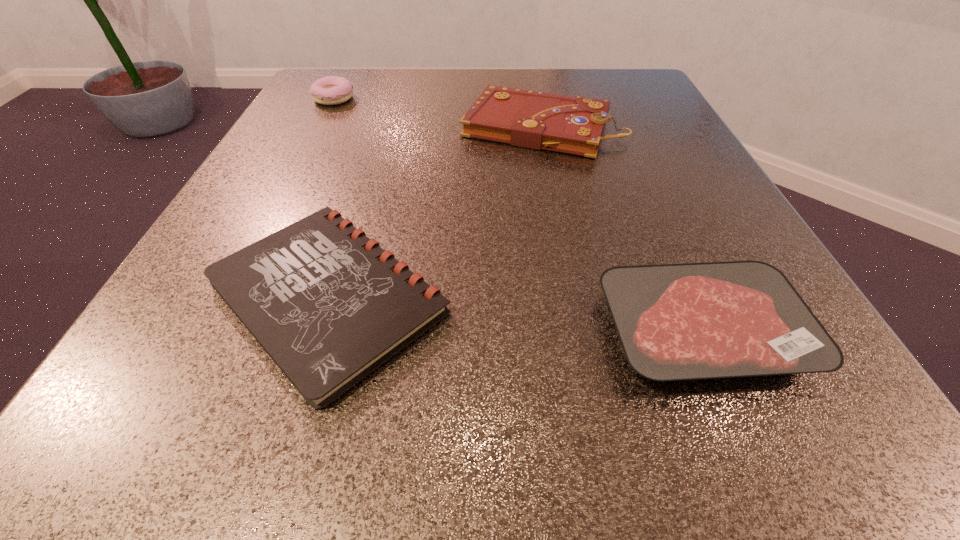
At what (x,y) coordinates should I click in order to perform the action: click on the taller notebook. Please return your answer as a coordinate pair (x, y). The width and height of the screenshot is (960, 540). Looking at the image, I should click on (538, 120).

You are a GUI agent. You are given a task and a screenshot of the screen. Output one action in this format:
    pyautogui.click(x=<x>, y=<y>)
    Task: Click on the doughnut
    This screenshot has height=540, width=960.
    Given the screenshot: What is the action you would take?
    pyautogui.click(x=331, y=90)

Find the location of `steak`. steak is located at coordinates (690, 321).

Locate an element on the screen. Image resolution: width=960 pixels, height=540 pixels. the shorter notebook is located at coordinates (329, 306).

The image size is (960, 540). Identify the location of blank space located on the back of the farther notebook. (532, 78).

In order to click on vacant area situated 0.070m on the back of the doughnut in this screenshot , I will do `click(346, 77)`.

I want to click on free space located on the left of the steak, so click(364, 330).

This screenshot has width=960, height=540. Find the location of `vacant region located on the back of the shorter notebook`. vacant region located on the back of the shorter notebook is located at coordinates (389, 105).

Identify the location of notebook situated at the far edge. (538, 120).

Image resolution: width=960 pixels, height=540 pixels. Identify the location of doughnut situated at the far edge. (331, 90).